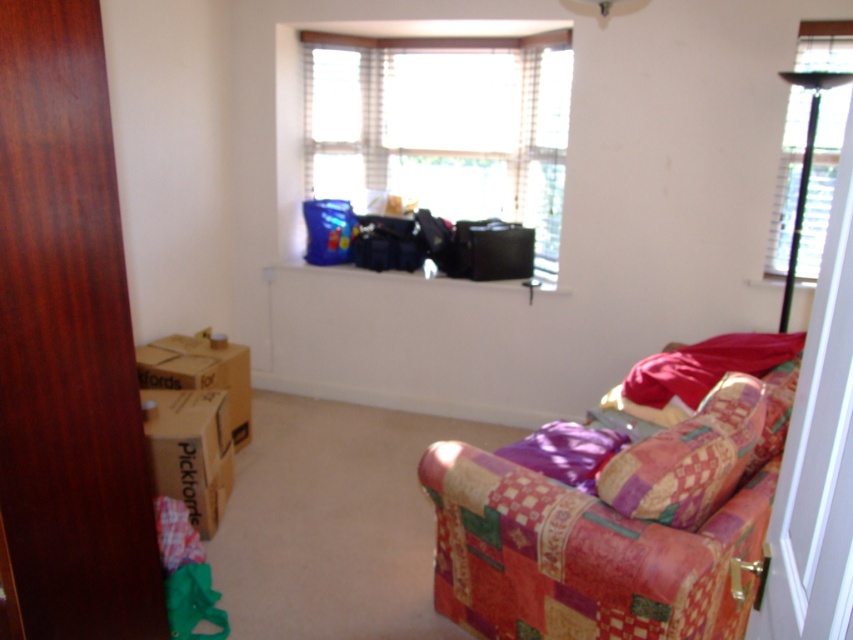
Consider the image. Is cardboard box at lower left further to camera compared to brown cardboard box at lower left?

No, cardboard box at lower left is closer to the viewer.

Who is lower down, cardboard box at lower left or brown cardboard box at lower left?

cardboard box at lower left is below.

Describe the element at coordinates (190, 451) in the screenshot. I see `cardboard box at lower left` at that location.

At what (x,y) coordinates should I click in order to perform the action: click on cardboard box at lower left. Please return your answer as a coordinate pair (x, y). The width and height of the screenshot is (853, 640). Looking at the image, I should click on (190, 451).

Which is above, patchwork fabric pillow at lower right or transparent glass window at upper right?

transparent glass window at upper right

Is patchwork fabric pillow at lower right wider than transparent glass window at upper right?

Correct, the width of patchwork fabric pillow at lower right exceeds that of transparent glass window at upper right.

Which is in front, point (705, 461) or point (808, 268)?

Point (705, 461) is more forward.

The height and width of the screenshot is (640, 853). I want to click on patchwork fabric pillow at lower right, so click(689, 458).

Between point (790, 172) and point (184, 404), which one is positioned in front?

Positioned in front is point (184, 404).

Does transparent glass window at upper right come behind cardboard box at lower left?

No, transparent glass window at upper right is in front of cardboard box at lower left.

Between point (821, 61) and point (202, 516), which one is positioned in front?

Positioned in front is point (202, 516).

Where is `transparent glass window at upper right`? The image size is (853, 640). transparent glass window at upper right is located at coordinates (821, 179).